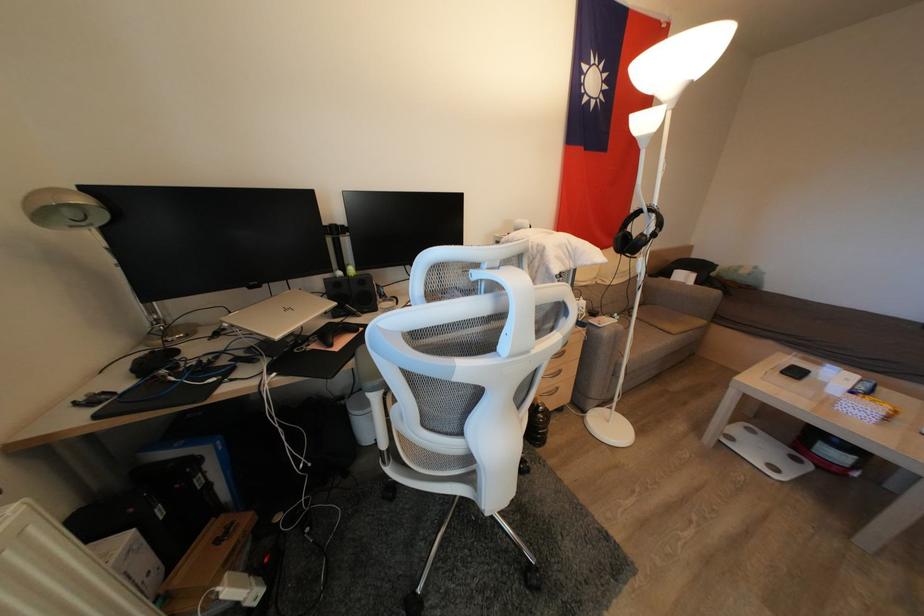
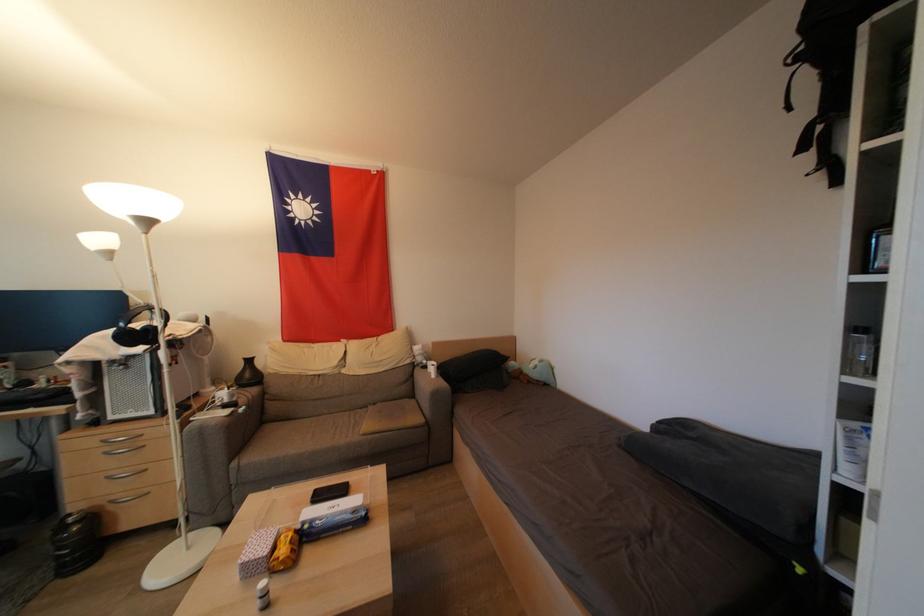
Where in the second image is the point corresponding to point 760,272 from the first image?

(545, 365)